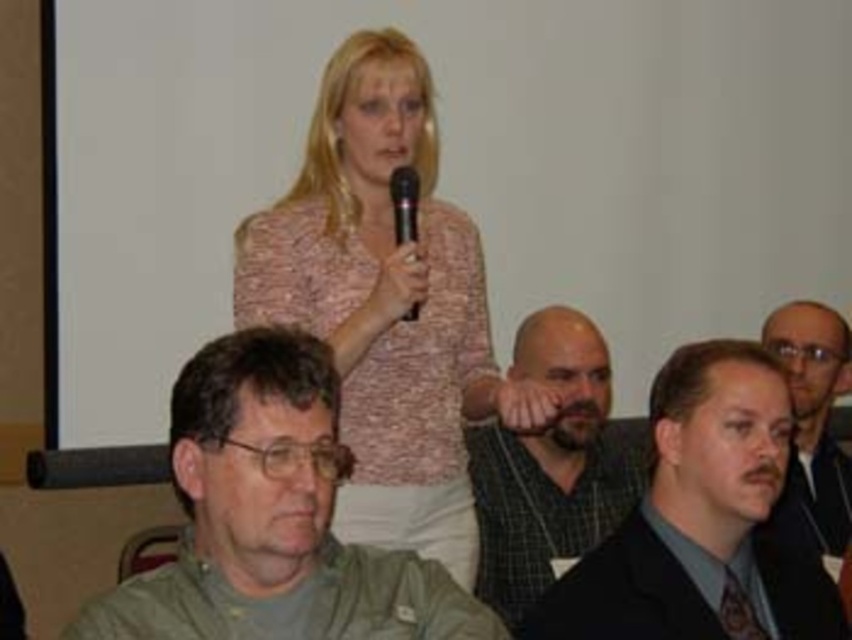
Is smooth black suit at right to the right of black plastic microphone at center from the viewer's perspective?

Yes, smooth black suit at right is to the right of black plastic microphone at center.

Find the location of a particular element. The width and height of the screenshot is (852, 640). smooth black suit at right is located at coordinates [815, 417].

Which is in front, point (252, 508) or point (833, 340)?

Point (252, 508)

Can you confirm if green matte shirt at lower left is positioned above smooth black suit at right?

No.

Which is in front, point (297, 506) or point (820, 509)?

Point (297, 506)

This screenshot has width=852, height=640. I want to click on green matte shirt at lower left, so click(273, 516).

Between point (590, 545) and point (403, 172), which one is positioned behind?

Positioned behind is point (590, 545).

Does checkered fabric shirt at center have a lesser width compared to black plastic microphone at center?

No.

Where is `checkered fabric shirt at center`? The image size is (852, 640). checkered fabric shirt at center is located at coordinates (551, 465).